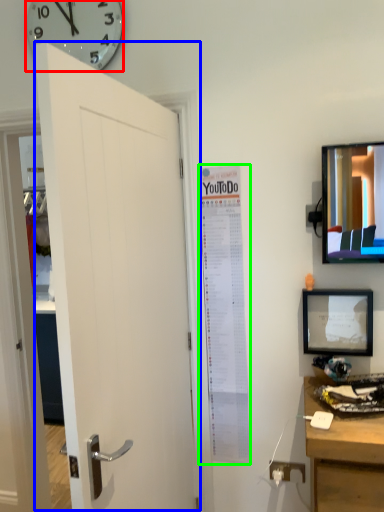
Question: Which is farther away from wall clock (highlighted by a red box)? door (highlighted by a blue box) or poster page (highlighted by a green box)?

Choices:
 (A) door
 (B) poster page

Answer: (B)